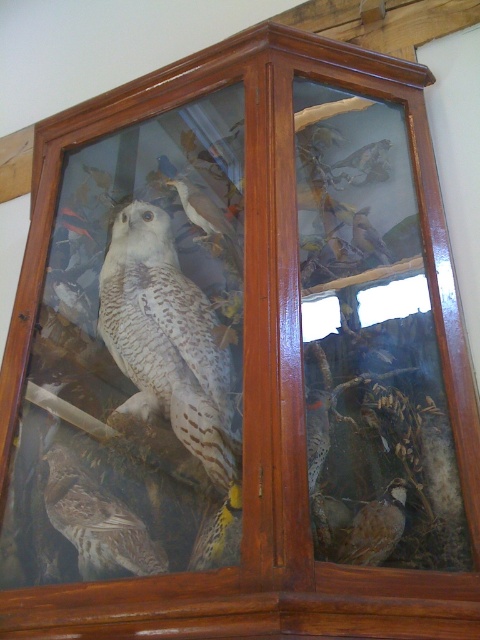
Is the position of speckled white owl at center less distant than that of brown speckled feathers at lower right?

No, speckled white owl at center is further to the viewer.

Who is taller, speckled white owl at center or brown speckled feathers at lower right?

speckled white owl at center is taller.

This screenshot has width=480, height=640. What do you see at coordinates (168, 340) in the screenshot?
I see `speckled white owl at center` at bounding box center [168, 340].

The height and width of the screenshot is (640, 480). I want to click on speckled white owl at center, so click(168, 340).

Does speckled white owl at center have a lesser height compared to brown speckled feathers at upper right?

No.

Measure the distance between point (180, 323) and camera.

A distance of 4.24 feet exists between point (180, 323) and camera.

The image size is (480, 640). I want to click on speckled white owl at center, so click(168, 340).

This screenshot has width=480, height=640. What do you see at coordinates (96, 522) in the screenshot? I see `brown speckled feathers at lower left` at bounding box center [96, 522].

What do you see at coordinates (96, 522) in the screenshot? The width and height of the screenshot is (480, 640). I see `brown speckled feathers at lower left` at bounding box center [96, 522].

In order to click on brown speckled feathers at lower left in this screenshot , I will do `click(96, 522)`.